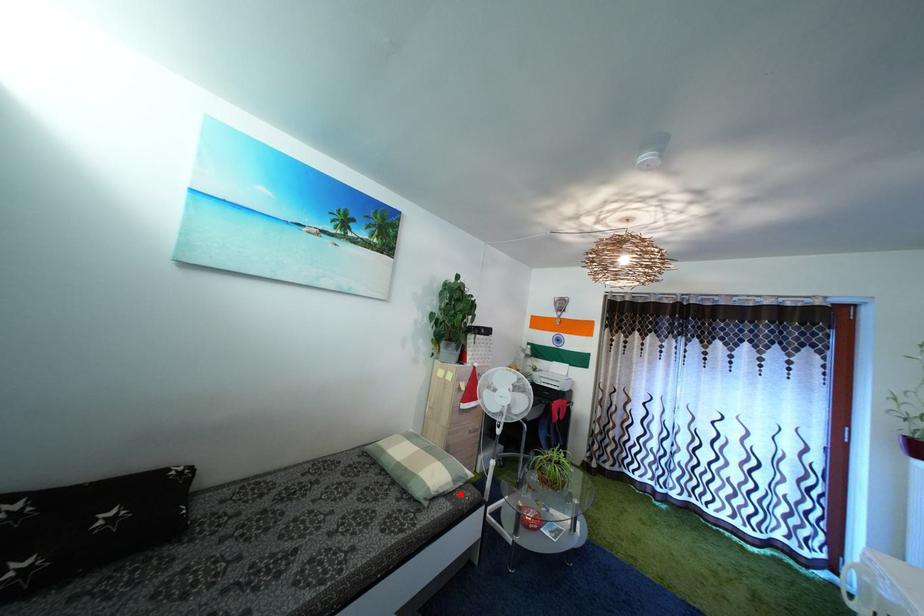
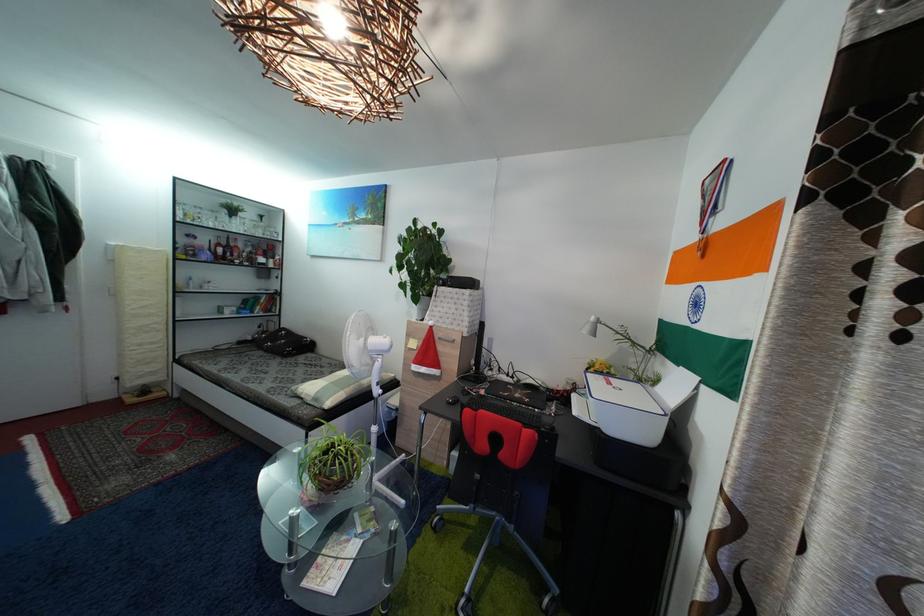
Question: A red point is marked in image1. In image2, is the corresponding 3D point closer to the camera or farther? Reply with the corresponding letter.

Choices:
 (A) The corresponding 3D point is closer.
 (B) The corresponding 3D point is farther.

Answer: (B)